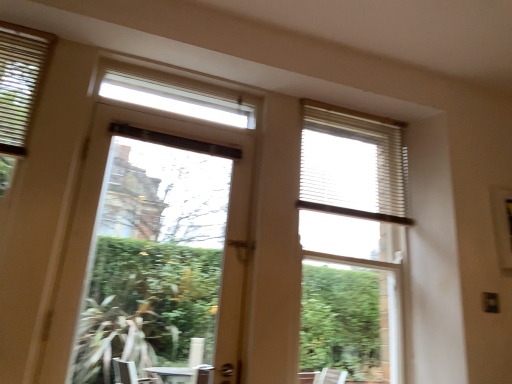
What do you see at coordinates (352, 164) in the screenshot?
I see `white textured blind at upper right` at bounding box center [352, 164].

This screenshot has height=384, width=512. What do you see at coordinates (155, 253) in the screenshot?
I see `clear glass window at left` at bounding box center [155, 253].

The height and width of the screenshot is (384, 512). Identify the location of clear glass window at left. 155,253.

Identify the location of white textured blinds at upper right. This screenshot has width=512, height=384. (351, 244).

Which is more to the right, clear glass window at left or white textured blind at upper right?

white textured blind at upper right is more to the right.

From a real-world perspective, which object rests below the other?

In real-world perspective, clear glass window at left is lower.

Is white textured blind at upper right located within clear glass window at left?

No, white textured blind at upper right is located outside of clear glass window at left.

Considering the sizes of objects clear glass window at left and white textured blind at upper right in the image provided, who is smaller, clear glass window at left or white textured blind at upper right?

With smaller size is white textured blind at upper right.

In terms of width, does white textured blind at upper right look wider or thinner when compared to matte white blinds at upper left?

Clearly, white textured blind at upper right has more width compared to matte white blinds at upper left.

Is the position of white textured blind at upper right more distant than that of matte white blinds at upper left?

Yes, white textured blind at upper right is further from the viewer.

Between white textured blind at upper right and matte white blinds at upper left, which one has more height?

With more height is white textured blind at upper right.

Which point is more distant from viewer, (x=340, y=162) or (x=6, y=130)?

The point (x=340, y=162) is behind.

Looking at this image, which is more distant, (x=212, y=299) or (x=328, y=251)?

Point (x=212, y=299)

How many degrees apart are the facing directions of clear glass window at left and white textured blinds at upper right?

1.21 degrees.

Is clear glass window at left in front of or behind white textured blinds at upper right in the image?

clear glass window at left is in front of white textured blinds at upper right.

From the image's perspective, is matte white blinds at upper left beneath clear glass window at left?

Actually, matte white blinds at upper left appears above clear glass window at left in the image.

Which of these two, matte white blinds at upper left or clear glass window at left, stands shorter?

matte white blinds at upper left is shorter.

Is matte white blinds at upper left to the left of clear glass window at left from the viewer's perspective?

Yes, matte white blinds at upper left is to the left of clear glass window at left.

Considering their positions, is matte white blinds at upper left located in front of or behind clear glass window at left?

matte white blinds at upper left is positioned farther from the viewer than clear glass window at left.

Consider the image. Is clear glass window at left spatially inside matte white blinds at upper left, or outside of it?

clear glass window at left is spatially situated outside matte white blinds at upper left.

Could you tell me if clear glass window at left is facing matte white blinds at upper left?

No, clear glass window at left is not turned towards matte white blinds at upper left.

Considering the relative positions of clear glass window at left and matte white blinds at upper left in the image provided, is clear glass window at left behind matte white blinds at upper left?

No, clear glass window at left is closer to the camera.

The width and height of the screenshot is (512, 384). In order to click on window blind above the clear glass window at left (from the image's perspective) in this screenshot , I will do `click(20, 82)`.

From the picture: Are white textured blinds at upper right and white textured blind at upper right making contact?

No, white textured blinds at upper right is not beside white textured blind at upper right.

Based on the photo, what's the angular difference between white textured blinds at upper right and white textured blind at upper right's facing directions?

There is a 0.00285-degree angle between the facing directions of white textured blinds at upper right and white textured blind at upper right.

Is white textured blinds at upper right to the left or to the right of white textured blind at upper right in the image?

white textured blinds at upper right is to the left of white textured blind at upper right.

Measure the distance from white textured blinds at upper right to white textured blind at upper right.

The distance of white textured blinds at upper right from white textured blind at upper right is 6.13 inches.

Who is smaller, white textured blinds at upper right or clear glass window at left?

Smaller between the two is white textured blinds at upper right.

Which is closer to the camera, (366, 315) or (139, 268)?

Point (366, 315)

Is white textured blinds at upper right oriented away from clear glass window at left?

That's not correct — white textured blinds at upper right is not looking away from clear glass window at left.

At what (x,y) coordinates should I click in order to perform the action: click on blind on the right of clear glass window at left. Please return your answer as a coordinate pair (x, y). Looking at the image, I should click on (352, 164).

The image size is (512, 384). Identify the location of blind behind the matte white blinds at upper left. (352, 164).

When comparing their distances from matte white blinds at upper left, does white textured blinds at upper right or clear glass window at left seem further?

Based on the image, white textured blinds at upper right appears to be further to matte white blinds at upper left.

When comparing their distances from matte white blinds at upper left, does white textured blinds at upper right or white textured blind at upper right seem closer?

Among the two, white textured blind at upper right is located nearer to matte white blinds at upper left.

Estimate the real-world distances between objects in this image. Which object is further from matte white blinds at upper left, clear glass window at left or white textured blind at upper right?

The object further to matte white blinds at upper left is white textured blind at upper right.

Estimate the real-world distances between objects in this image. Which object is further from matte white blinds at upper left, clear glass window at left or white textured blinds at upper right?

white textured blinds at upper right is positioned further to the anchor matte white blinds at upper left.

Looking at the image, which one is located closer to matte white blinds at upper left, white textured blind at upper right or white textured blinds at upper right?

white textured blind at upper right lies closer to matte white blinds at upper left than the other object.

Based on their spatial positions, is clear glass window at left or matte white blinds at upper left further from white textured blind at upper right?

The object further to white textured blind at upper right is matte white blinds at upper left.

Considering their positions, is matte white blinds at upper left positioned closer to white textured blind at upper right than white textured blinds at upper right?

white textured blinds at upper right is closer to white textured blind at upper right.

Based on their spatial positions, is white textured blind at upper right or clear glass window at left further from matte white blinds at upper left?

Based on the image, white textured blind at upper right appears to be further to matte white blinds at upper left.

This screenshot has height=384, width=512. I want to click on window screen situated between matte white blinds at upper left and white textured blinds at upper right from left to right, so click(155, 253).

I want to click on window screen between matte white blinds at upper left and white textured blind at upper right from left to right, so click(x=155, y=253).

You are a GUI agent. You are given a task and a screenshot of the screen. Output one action in this format:
    pyautogui.click(x=<x>, y=<y>)
    Task: Click on the bay window situated between matte white blinds at upper left and white textured blind at upper right from left to right
    
    Given the screenshot: What is the action you would take?
    pyautogui.click(x=351, y=244)

You are a GUI agent. You are given a task and a screenshot of the screen. Output one action in this format:
    pyautogui.click(x=<x>, y=<y>)
    Task: Click on the bay window located between clear glass window at left and white textured blind at upper right in the left-right direction
    This screenshot has width=512, height=384.
    Given the screenshot: What is the action you would take?
    pyautogui.click(x=351, y=244)